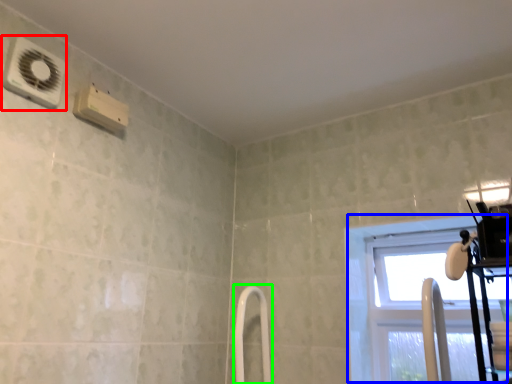
Question: Which object is positioned closest to air conditioning (highlighted by a red box)? Select from window (highlighted by a blue box) and shower door (highlighted by a green box).

Choices:
 (A) window
 (B) shower door

Answer: (B)